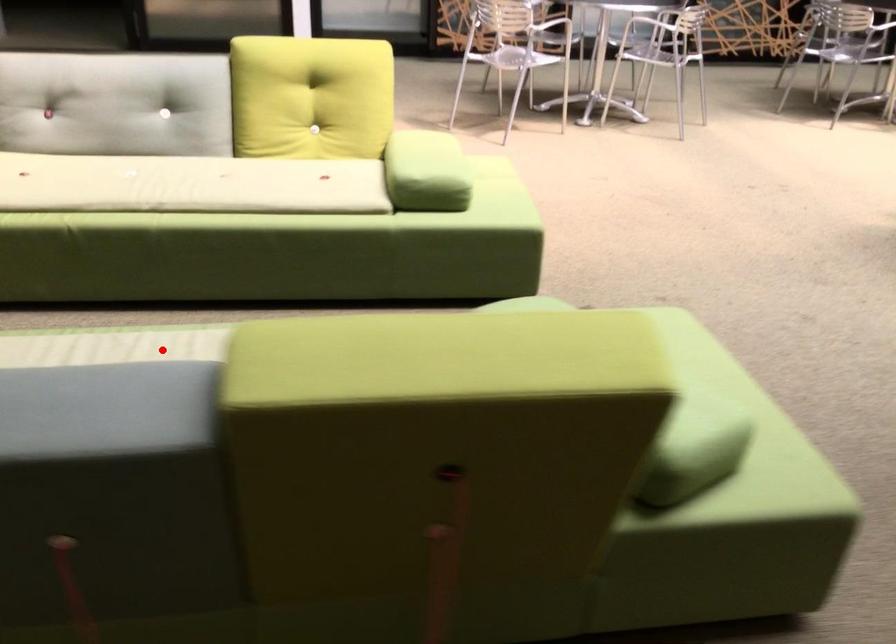
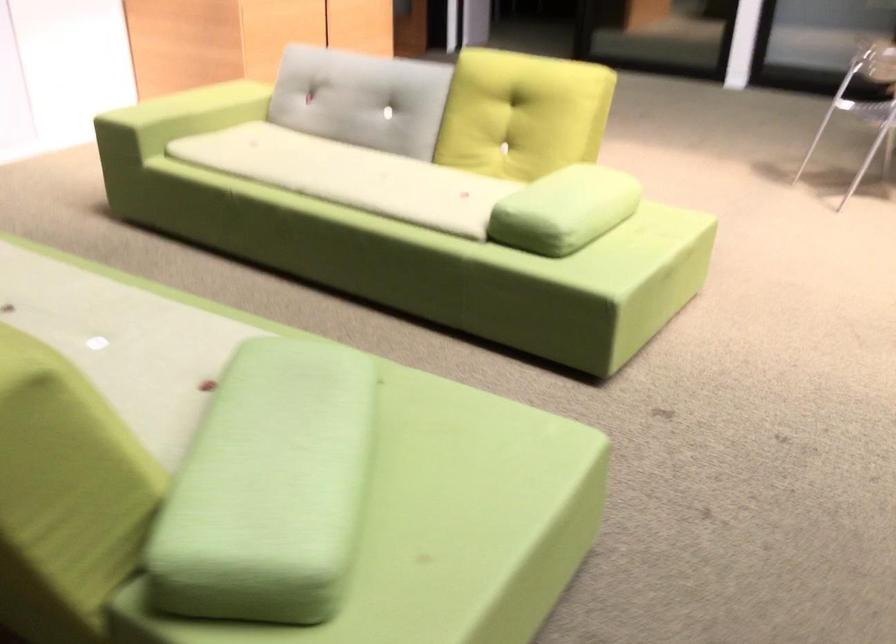
Find the pixel in the second image that matches the highlighted location in the first image.

(66, 290)